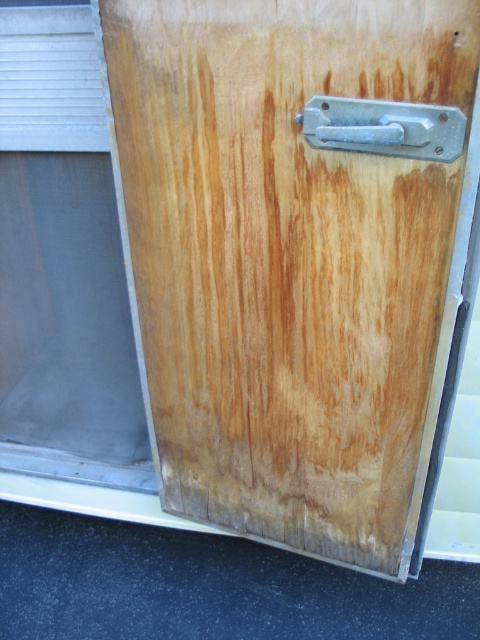
Question: Can you confirm if natural wood door at center is smaller than metallic silver door handle at upper center?

Choices:
 (A) yes
 (B) no

Answer: (B)

Question: Among these points, which one is nearest to the camera?

Choices:
 (A) [x=432, y=134]
 (B) [x=184, y=131]

Answer: (A)

Question: Does natural wood door at center have a lesser width compared to transparent plastic window at upper left?

Choices:
 (A) no
 (B) yes

Answer: (A)

Question: Does natural wood door at center have a lesser width compared to transparent plastic window at upper left?

Choices:
 (A) yes
 (B) no

Answer: (B)

Question: Which point is closer to the camera?

Choices:
 (A) metallic silver door handle at upper center
 (B) natural wood door at center

Answer: (B)

Question: Among these objects, which one is farthest from the camera?

Choices:
 (A) transparent plastic window at upper left
 (B) metallic silver door handle at upper center
 (C) natural wood door at center

Answer: (A)